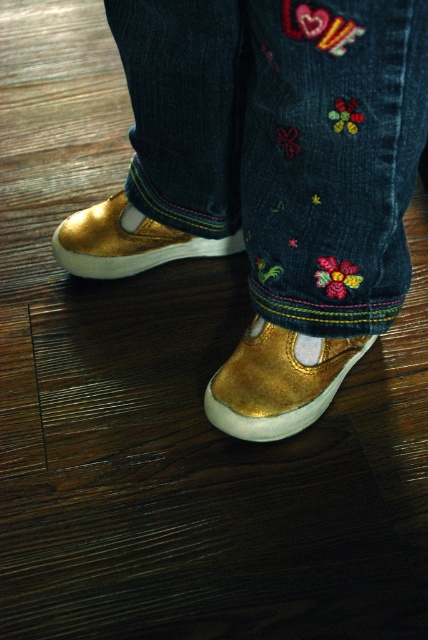
From the picture: You are trying to decide which shoe to wear for a casual event. Both the gold suede shoe at lower center and the gold metallic shoe at left are options. Based on their sizes, which one would you choose if you prefer a larger shoe?

The gold suede shoe at lower center is larger in size than the gold metallic shoe at left, so you should choose the gold suede shoe at lower center if you prefer a larger shoe.

You are a fashion designer looking at this image. You need to determine the spatial relationship between the denim jeans with embroidered patches at center and the gold metallic shoe at left. Which one is positioned higher?

The denim jeans with embroidered patches at center is above the gold metallic shoe at left, so it is positioned higher.